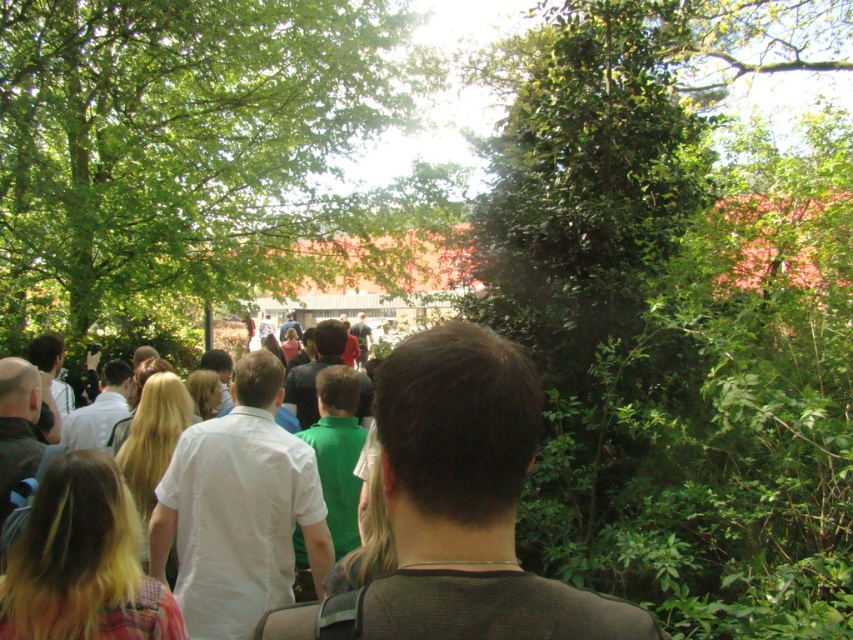
Question: In this image, where is green leafy tree at center located relative to white cotton shirt at center?

Choices:
 (A) right
 (B) left

Answer: (B)

Question: Can you confirm if white shirt at center is positioned below white cotton shirt at center?

Choices:
 (A) yes
 (B) no

Answer: (B)

Question: Which point is farther to the camera?

Choices:
 (A) (289, 467)
 (B) (312, 564)
 (C) (28, 141)

Answer: (C)

Question: Which object is farther from the camera taking this photo?

Choices:
 (A) white cotton shirt at center
 (B) green leafy tree at center

Answer: (B)

Question: Does green leafy tree at center have a larger size compared to white shirt at center?

Choices:
 (A) yes
 (B) no

Answer: (B)

Question: Which object is farther from the camera taking this photo?

Choices:
 (A) white shirt at center
 (B) white cotton shirt at center
 (C) green leafy tree at center

Answer: (C)